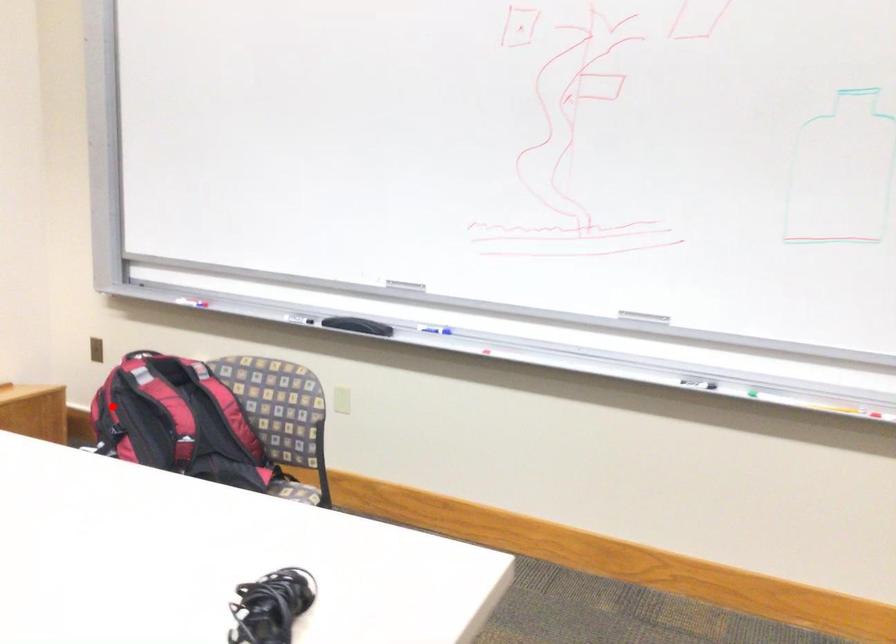
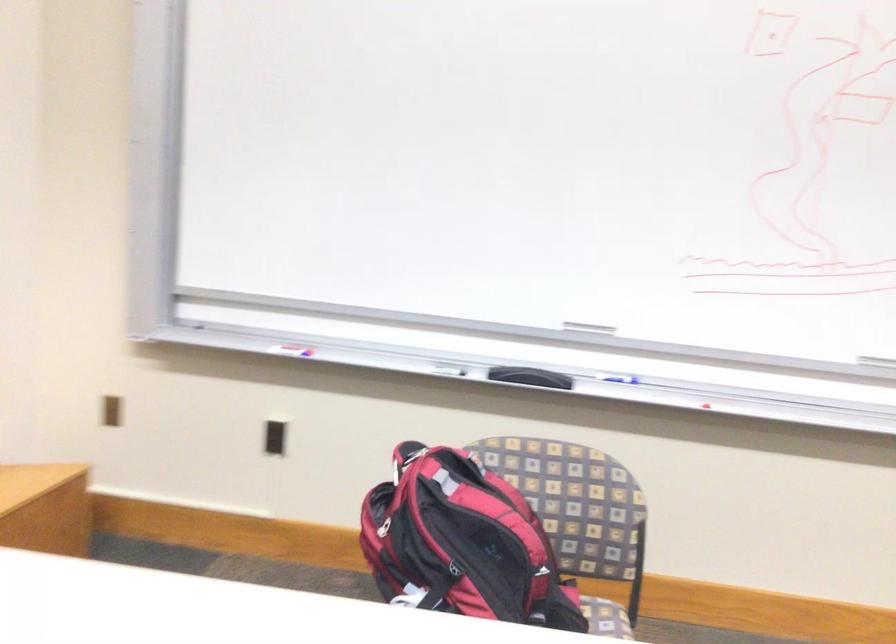
Find the pixel in the second image that matches the highlighted location in the first image.

(383, 527)